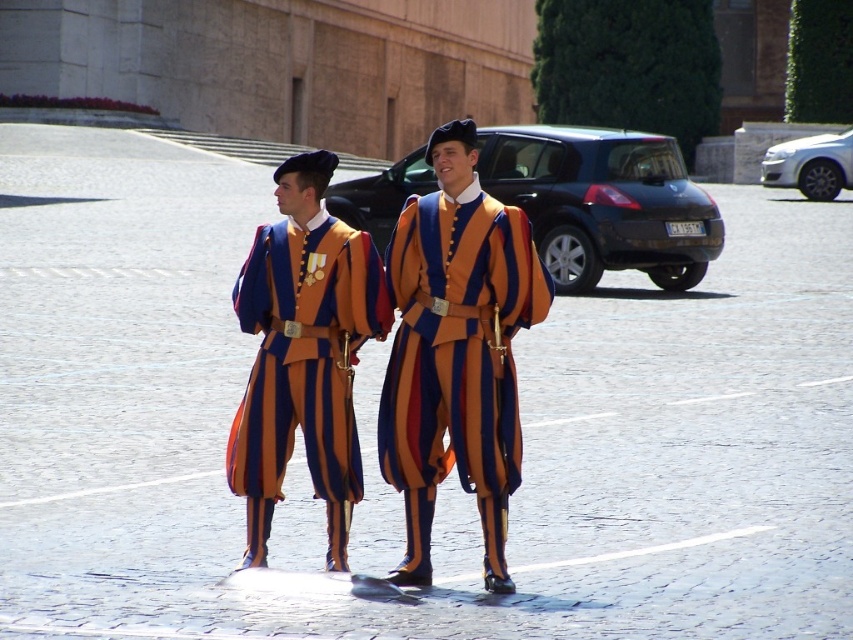
Based on the photo, can you confirm if orange and blue striped uniform at center is thinner than matte striped uniform at center?

In fact, orange and blue striped uniform at center might be wider than matte striped uniform at center.

Does point (431, 444) come in front of point (300, 342)?

Yes, it is.

What do you see at coordinates (456, 352) in the screenshot?
I see `orange and blue striped uniform at center` at bounding box center [456, 352].

Identify the location of orange and blue striped uniform at center. (456, 352).